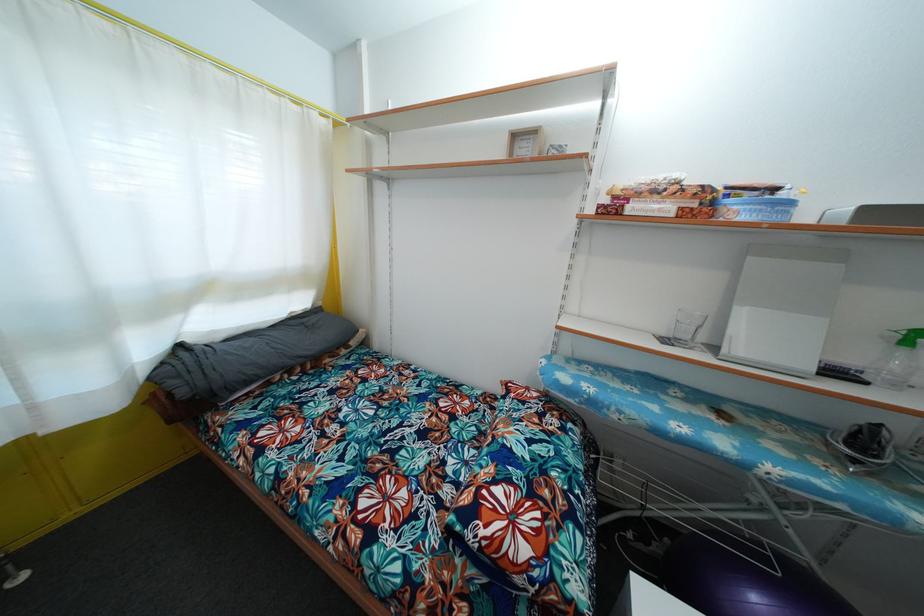
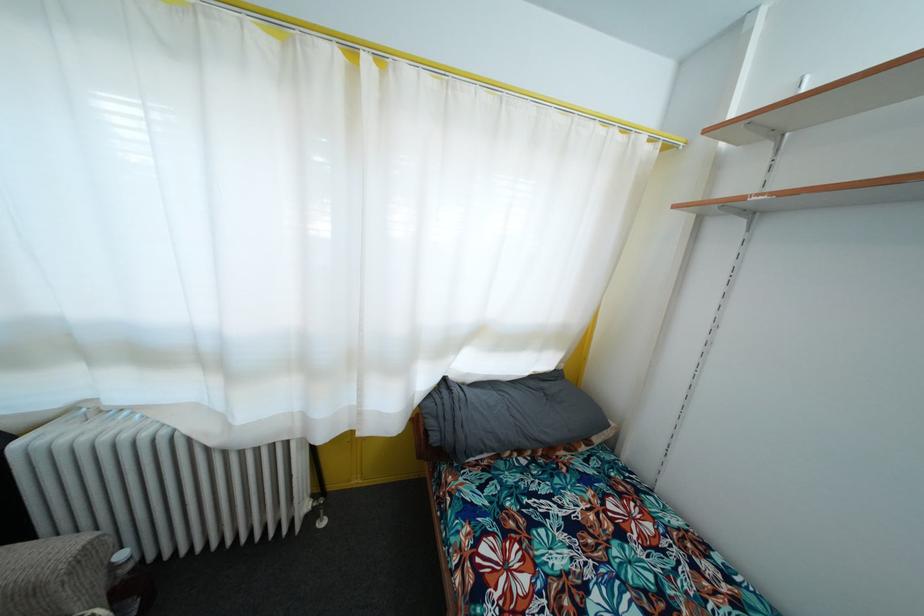
Question: Based on the continuous images, in which direction is the camera rotating? Reply with the corresponding letter.

Choices:
 (A) Left
 (B) Right
 (C) Up
 (D) Down

Answer: (A)